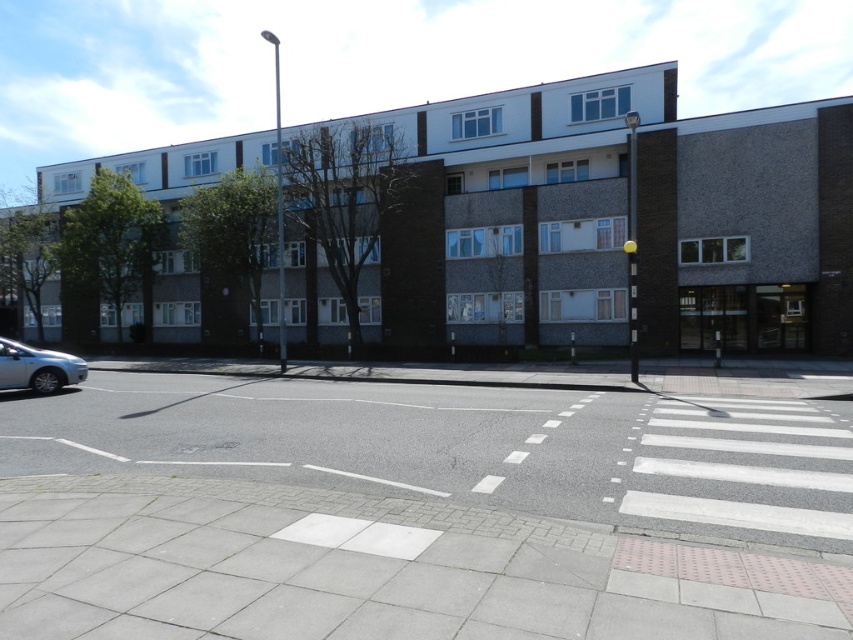
Between point (218, 456) and point (3, 378), which one is positioned in front?

Point (218, 456) is in front.

Does point (633, 458) come in front of point (61, 387)?

Yes, it is.

Where is `white asphalt at center`? white asphalt at center is located at coordinates (466, 448).

Find the location of a particular element. Image resolution: width=853 pixels, height=640 pixels. white asphalt at center is located at coordinates (466, 448).